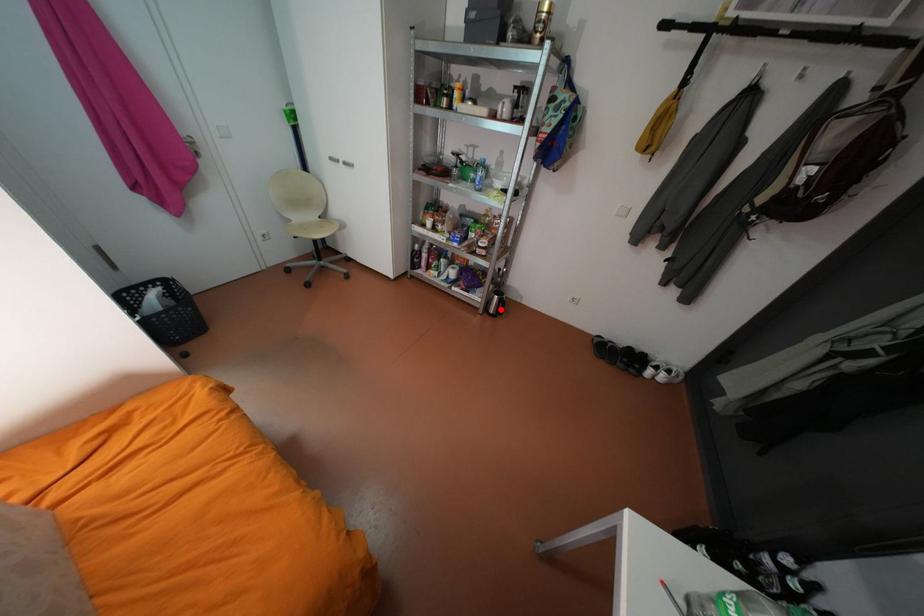
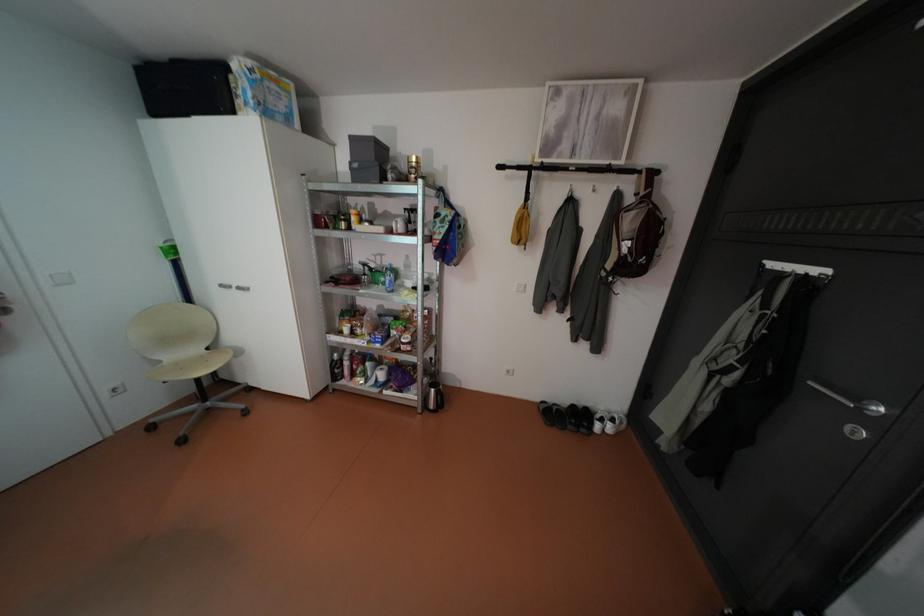
Find the pixel in the second image that matches the highlighted location in the first image.

(441, 405)